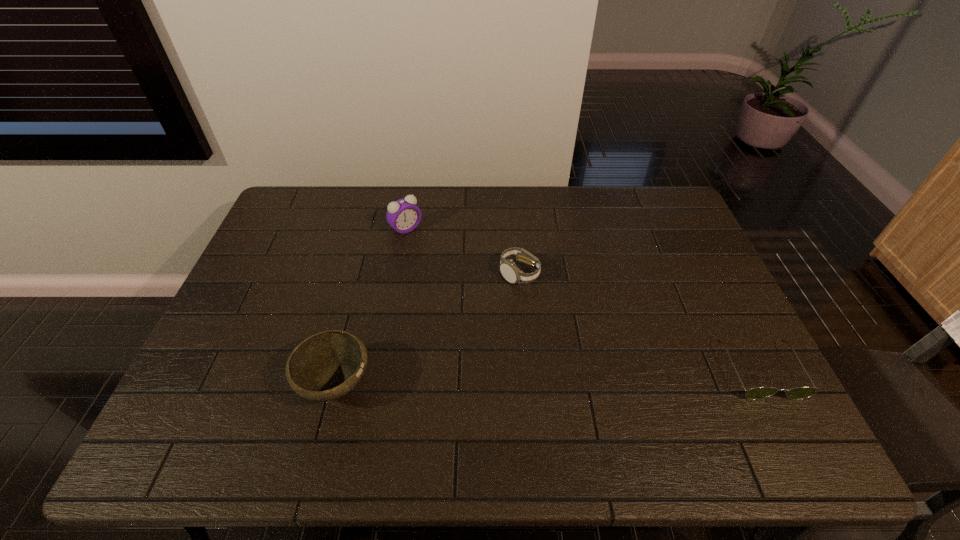
What are the coordinates of `bowl` in the screenshot? It's located at (325, 366).

Locate an element on the screen. the rightmost object is located at coordinates (756, 393).

You are a GUI agent. You are given a task and a screenshot of the screen. Output one action in this format:
    pyautogui.click(x=<x>, y=<y>)
    Task: Click on the shortest object
    
    Given the screenshot: What is the action you would take?
    pyautogui.click(x=756, y=393)

This screenshot has height=540, width=960. In order to click on watch in this screenshot , I will do `click(509, 270)`.

The image size is (960, 540). What are the coordinates of `the second farthest object` in the screenshot? It's located at (509, 270).

Locate an element on the screen. alarm clock is located at coordinates (403, 215).

At what (x,y) coordinates should I click in order to perform the action: click on free space located 0.250m on the back of the bowl. Please return your answer as a coordinate pair (x, y). Looking at the image, I should click on (362, 282).

I want to click on vacant space located on the face of the watch, so click(536, 341).

Where is `vacant space located 0.150m on the face of the watch`? The image size is (960, 540). vacant space located 0.150m on the face of the watch is located at coordinates (533, 329).

At what (x,y) coordinates should I click in order to perform the action: click on free spot located 0.330m on the face of the watch. Please return your answer as a coordinate pair (x, y). This screenshot has width=960, height=540. Looking at the image, I should click on (547, 389).